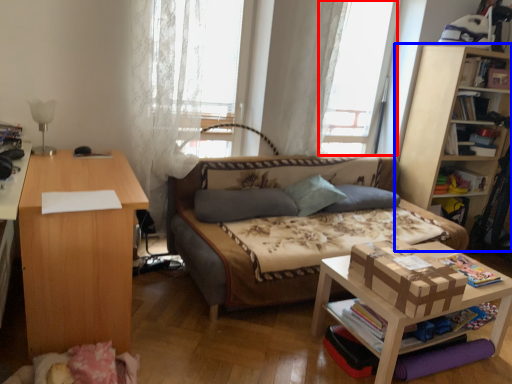
Question: Which object appears farthest to the camera in this image, window screen (highlighted by a red box) or bookcase (highlighted by a blue box)?

Choices:
 (A) window screen
 (B) bookcase

Answer: (B)